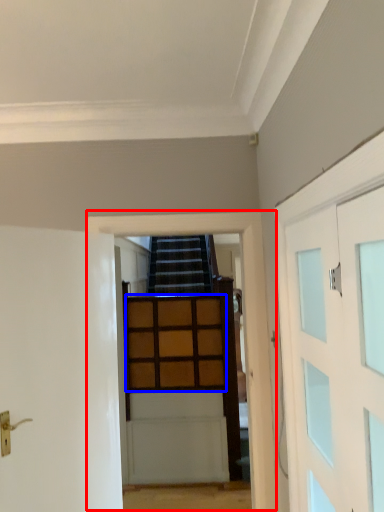
Question: Which of the following is the closest to the observer, garage door (highlighted by a red box) or cabinetry (highlighted by a blue box)?

Choices:
 (A) garage door
 (B) cabinetry

Answer: (A)